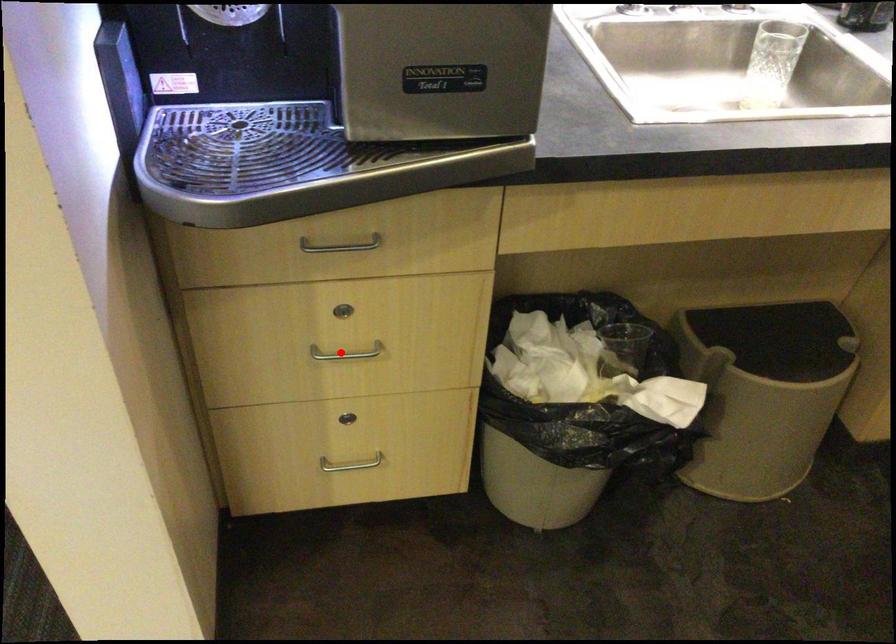
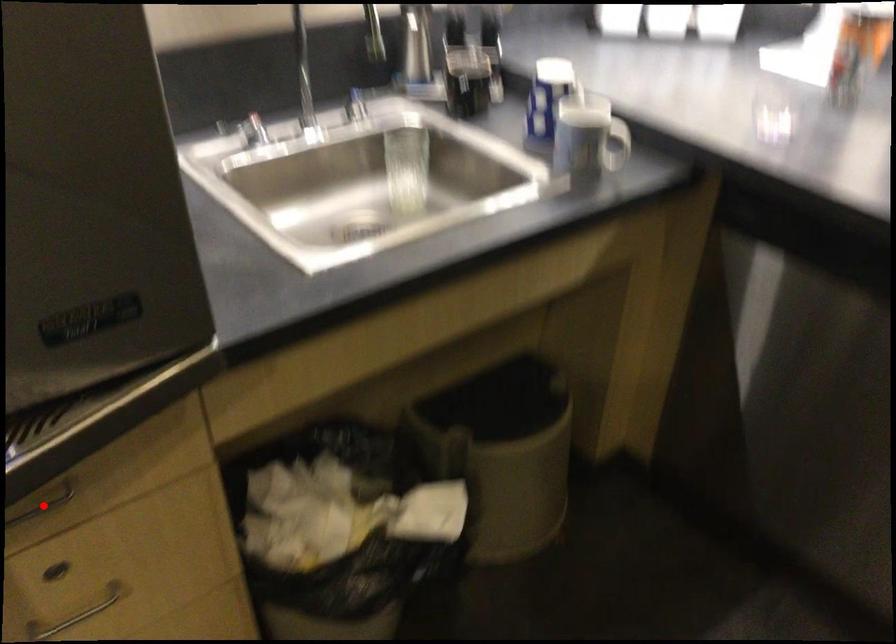
I am providing you with two images of the same scene from different viewpoints. A red point is marked on the first image and another point is marked on the second image. Is the marked point in image1 the same physical position as the marked point in image2?

No